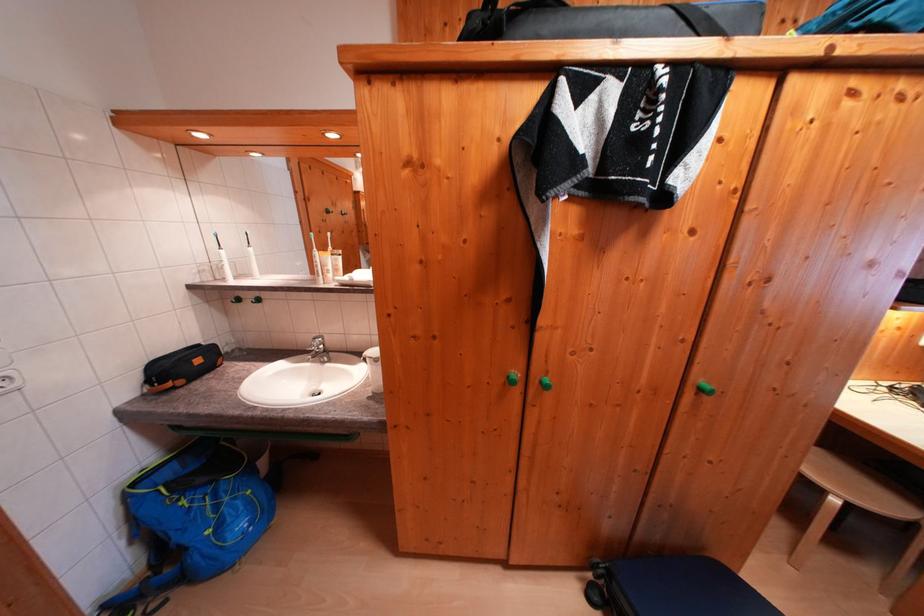
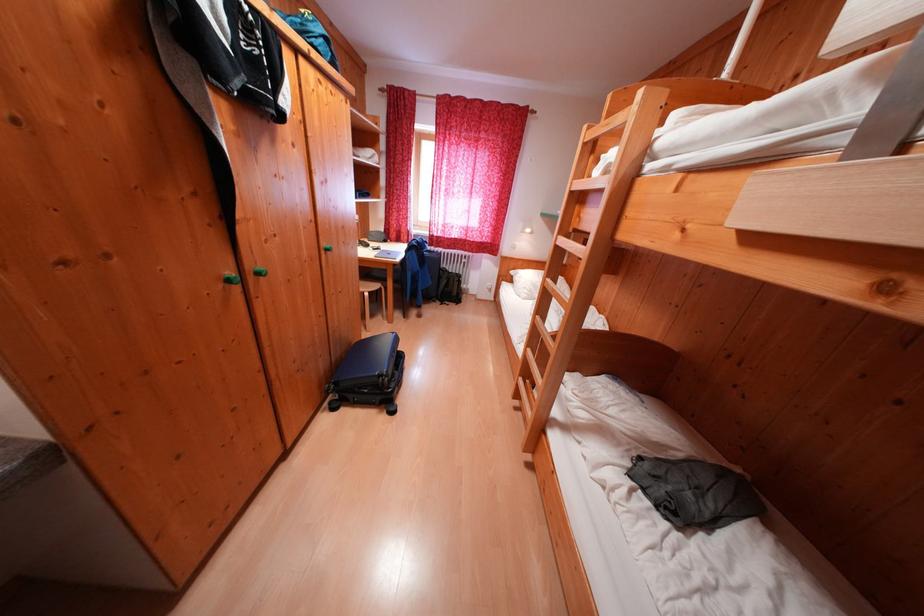
The point at (525, 378) is marked in the first image. Where is the corresponding point in the second image?

(238, 278)